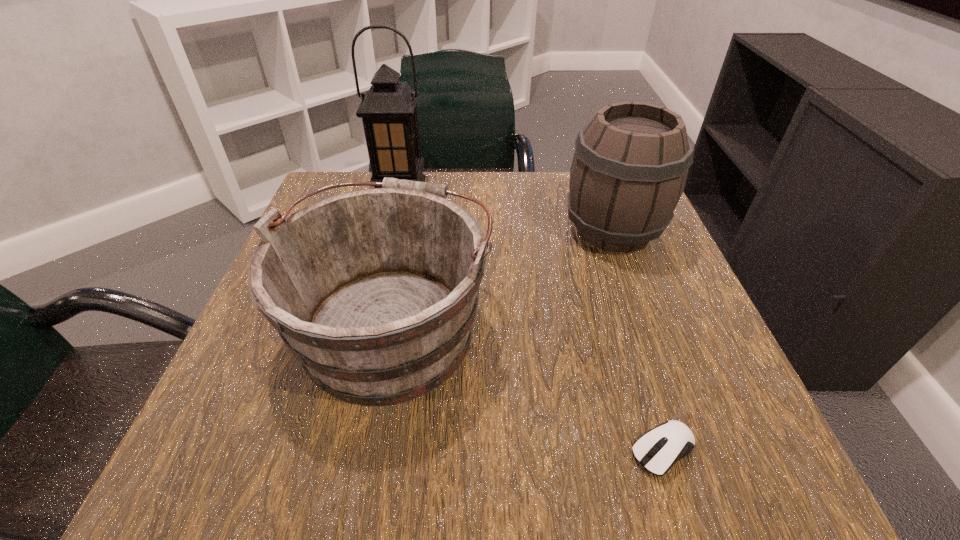
Identify the location of lantern. (388, 110).

Identify the location of the tallest object. The height and width of the screenshot is (540, 960). (388, 110).

The height and width of the screenshot is (540, 960). Identify the location of the taller wine bucket. (629, 169).

This screenshot has height=540, width=960. I want to click on the right wine bucket, so click(x=629, y=169).

The image size is (960, 540). Find the location of `the left wine bucket`. the left wine bucket is located at coordinates (375, 291).

The image size is (960, 540). Find the location of `the shorter wine bucket`. the shorter wine bucket is located at coordinates (375, 291).

Where is `the nearest object`? The width and height of the screenshot is (960, 540). the nearest object is located at coordinates (657, 450).

You are a GUI agent. You are given a task and a screenshot of the screen. Output one action in this format:
    pyautogui.click(x=<x>, y=<y>)
    Task: Click on the mouse
    
    Given the screenshot: What is the action you would take?
    pyautogui.click(x=657, y=450)

Where is `vacant position located 0.170m on the right of the farthest object`? The height and width of the screenshot is (540, 960). vacant position located 0.170m on the right of the farthest object is located at coordinates (497, 187).

Locate an element on the screen. vacant point located on the left of the taller wine bucket is located at coordinates (458, 230).